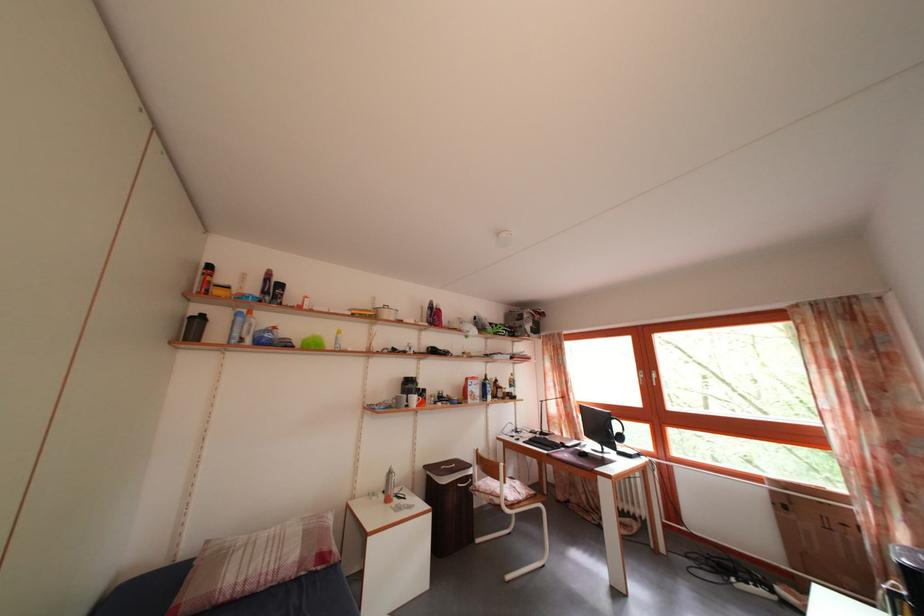
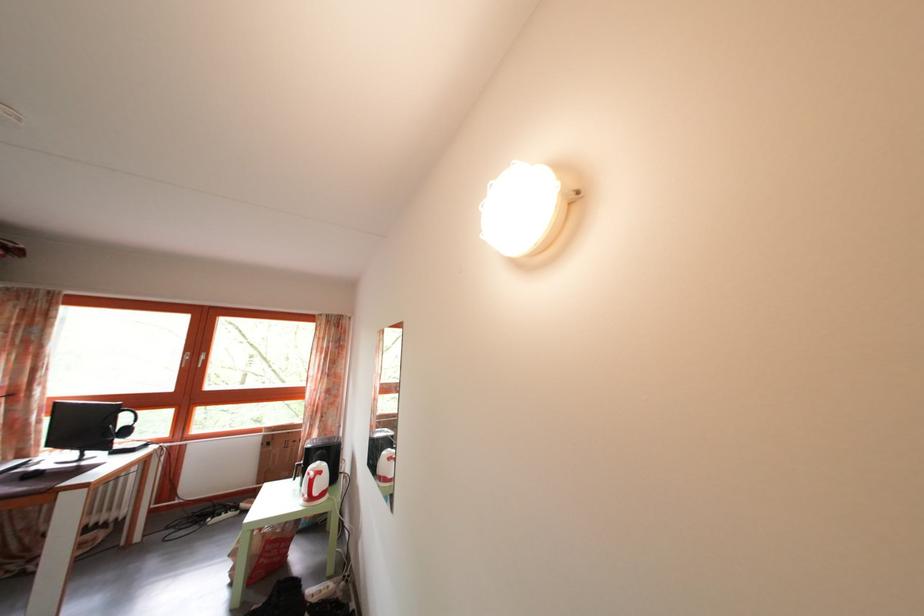
Locate, in the second image, the point that corresponds to (x=757, y=578) in the first image.

(233, 514)